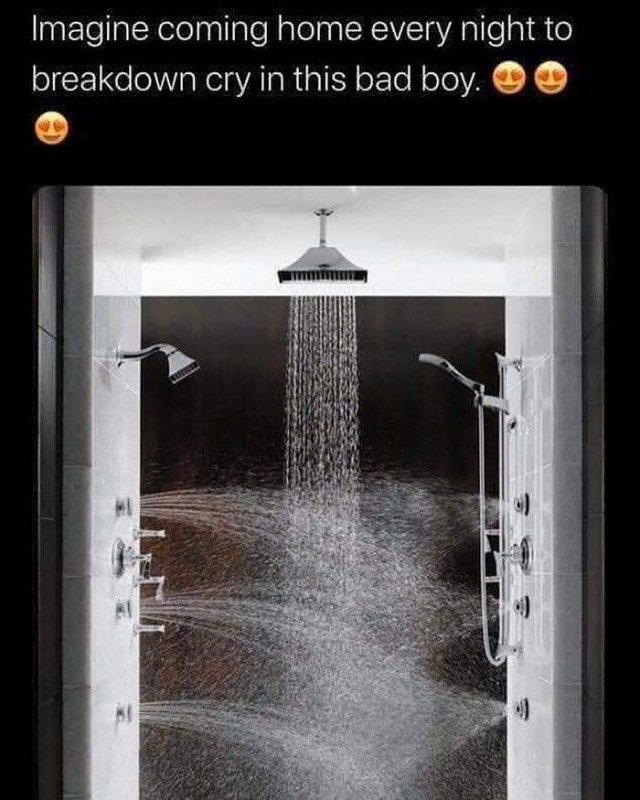
Image resolution: width=640 pixels, height=800 pixels. I want to click on knobs, so click(513, 566), click(122, 560), click(122, 613), click(123, 508), click(121, 712), click(520, 501), click(520, 706), click(522, 602).